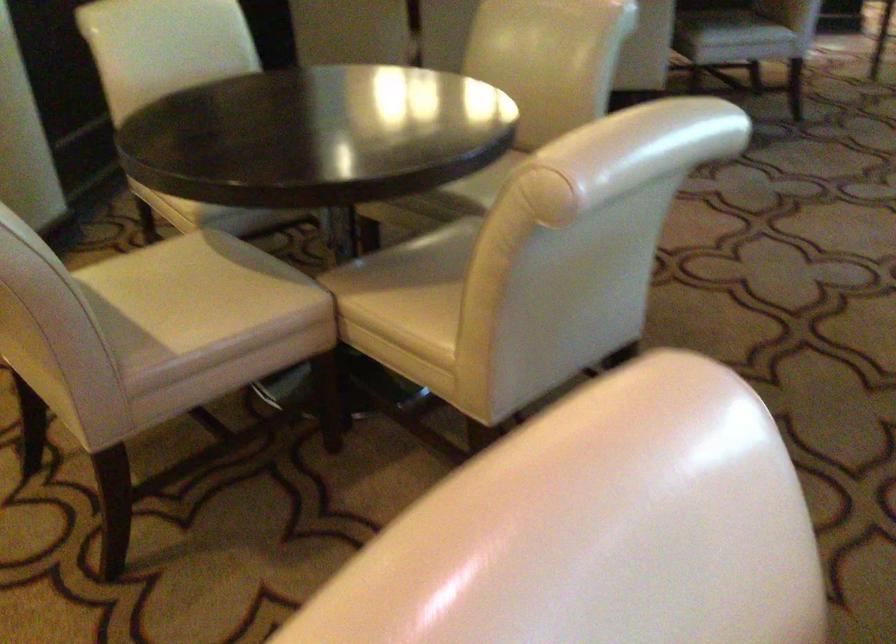
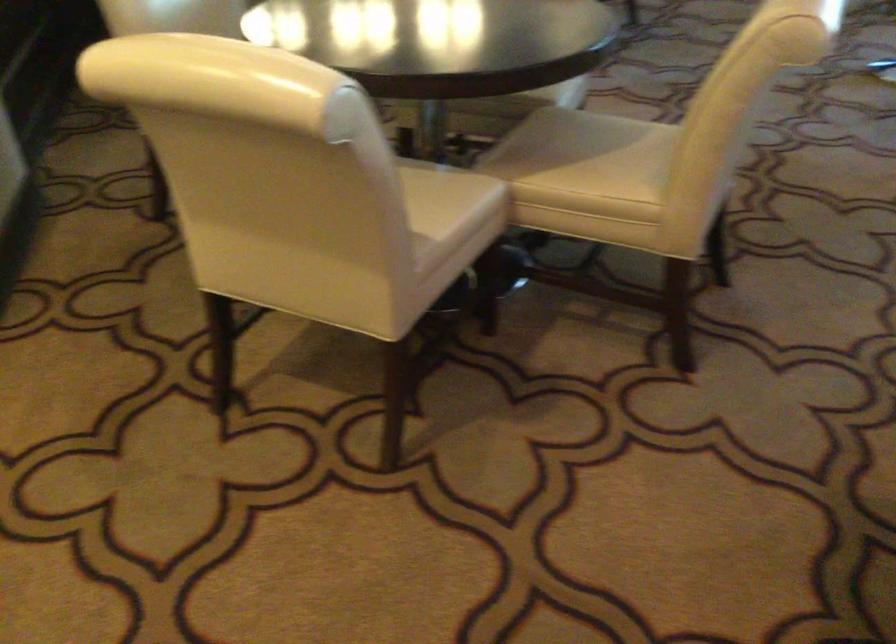
In the second image, find the point that corresponds to the point at 268,270 in the first image.

(437, 167)